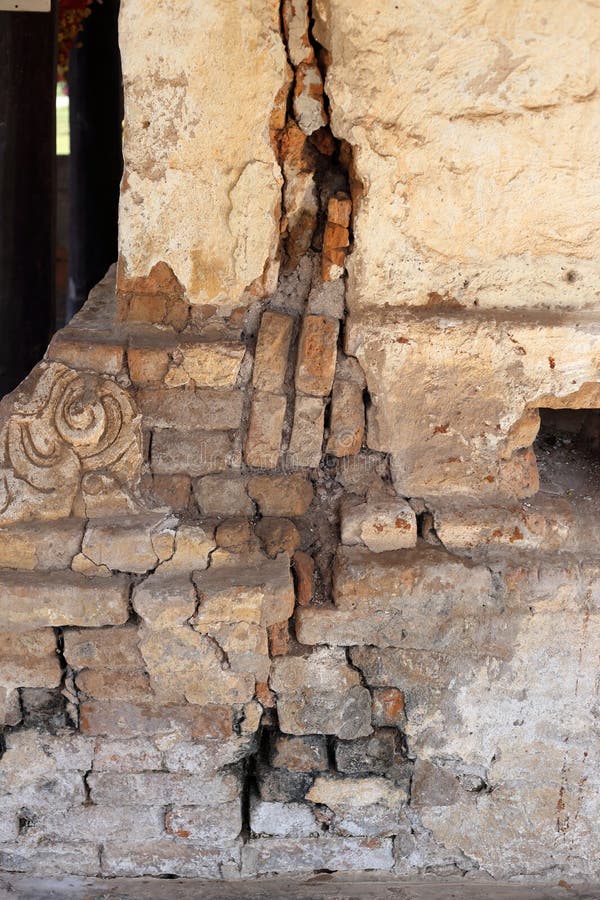
You are a GUI agent. You are given a task and a screenshot of the screen. Output one action in this format:
    pyautogui.click(x=<x>, y=<y>)
    Task: Click on the wall
    
    Given the screenshot: What is the action you would take?
    pyautogui.click(x=450, y=435)